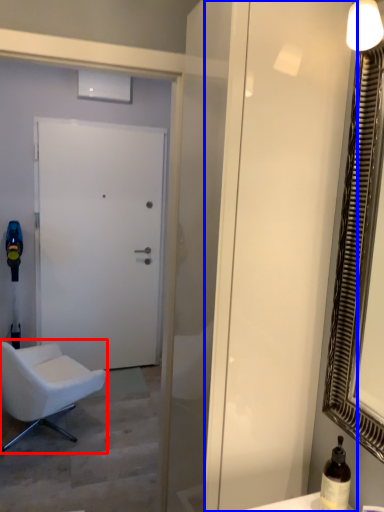
Question: Which object is further to the camera taking this photo, chair (highlighted by a red box) or screen door (highlighted by a blue box)?

Choices:
 (A) chair
 (B) screen door

Answer: (A)